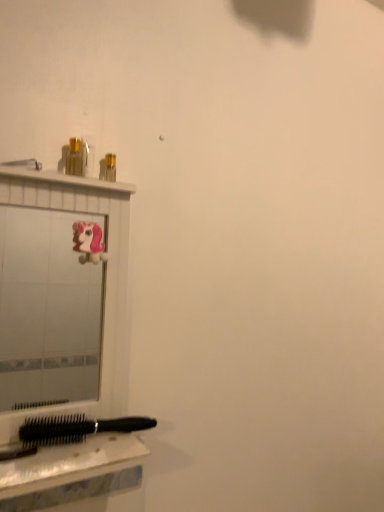
The height and width of the screenshot is (512, 384). Find the location of `free space above black plastic hairbrush at lower left (from a real-world perspective)`. free space above black plastic hairbrush at lower left (from a real-world perspective) is located at coordinates (47, 452).